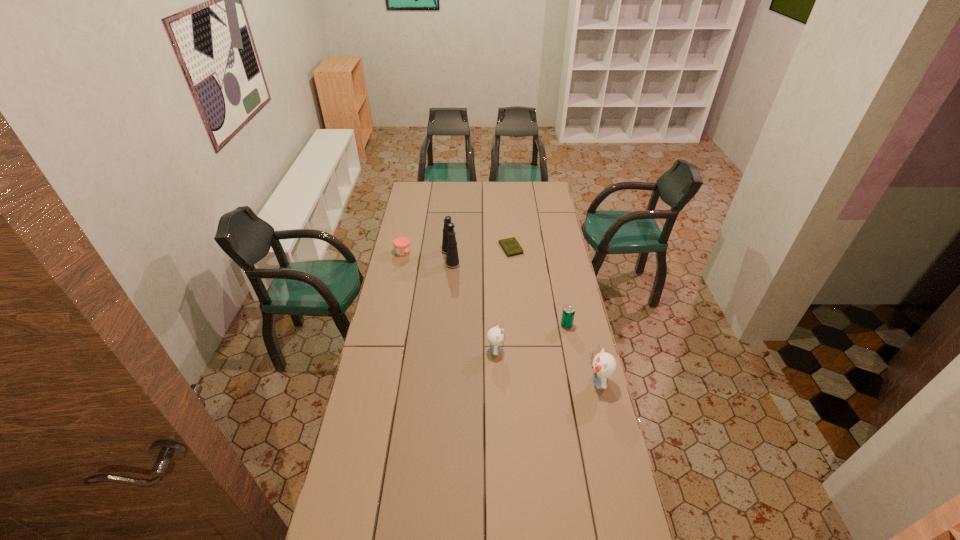
Where is `the fourth tallest object`? the fourth tallest object is located at coordinates (568, 313).

At what (x,y) coordinates should I click in order to perform the action: click on blank space located on the front-facing side of the shorter kitten. Please return your answer as a coordinate pair (x, y). The height and width of the screenshot is (540, 960). Looking at the image, I should click on [x=538, y=351].

You are a GUI agent. You are given a task and a screenshot of the screen. Output one action in this format:
    pyautogui.click(x=<x>, y=<y>)
    Task: Click on the free space located 0.150m on the front-facing side of the taller kitten
    The width and height of the screenshot is (960, 540).
    Given the screenshot: What is the action you would take?
    pyautogui.click(x=549, y=382)

Locate an element on the screen. The width and height of the screenshot is (960, 540). free space located 0.190m on the front-facing side of the taller kitten is located at coordinates (539, 382).

The height and width of the screenshot is (540, 960). Find the location of `free spot located on the front-facing side of the taller kitten`. free spot located on the front-facing side of the taller kitten is located at coordinates (562, 382).

Where is `vacant space located 0.260m on the back of the binoculars`? The width and height of the screenshot is (960, 540). vacant space located 0.260m on the back of the binoculars is located at coordinates (453, 220).

The width and height of the screenshot is (960, 540). Find the location of `vacant space located 0.070m on the front label of the fifth tallest object`. vacant space located 0.070m on the front label of the fifth tallest object is located at coordinates (424, 253).

You are a GUI agent. You are given a task and a screenshot of the screen. Output one action in this format:
    pyautogui.click(x=<x>, y=<y>)
    Task: Click on the free space located 0.110m on the right of the diary
    The image size is (960, 540).
    Given the screenshot: What is the action you would take?
    pyautogui.click(x=543, y=248)

I want to click on free space located 0.110m on the back of the third shortest object, so tap(563, 304).

Locate an element on the screen. object present at the left edge is located at coordinates (401, 244).